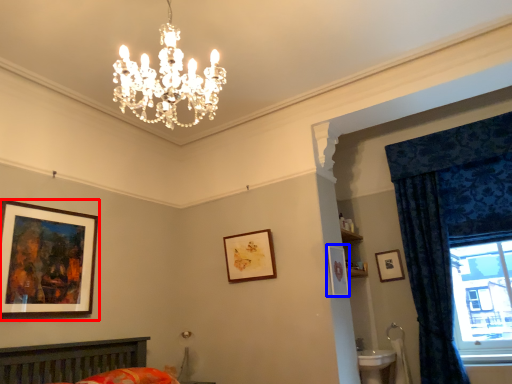
Question: Which point is closer to the camera, picture frame (highlighted by a red box) or picture frame (highlighted by a blue box)?

Choices:
 (A) picture frame
 (B) picture frame

Answer: (A)